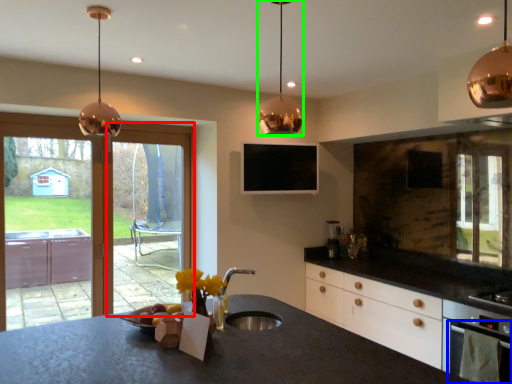
Question: Considering the real-world distances, which object is farthest from screen door (highlighted by a red box)? oven (highlighted by a blue box) or lamp (highlighted by a green box)?

Choices:
 (A) oven
 (B) lamp

Answer: (B)